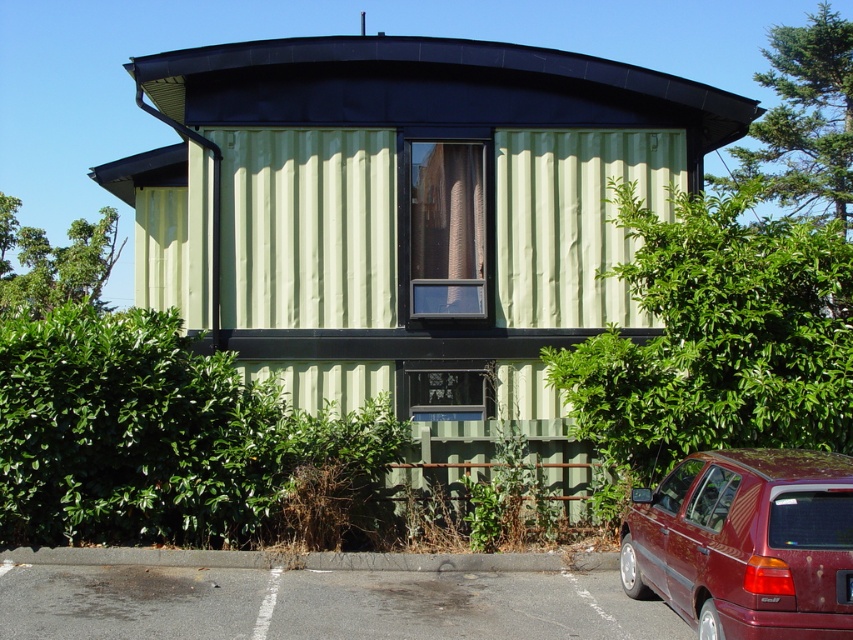
Can you confirm if gray asphalt parking lot at lower left is smaller than shiny maroon hatchback at lower right?

Yes.

Does point (297, 573) lie behind point (816, 554)?

Yes, point (297, 573) is behind point (816, 554).

Find the location of `gray asphalt parking lot at lower left`. gray asphalt parking lot at lower left is located at coordinates (318, 604).